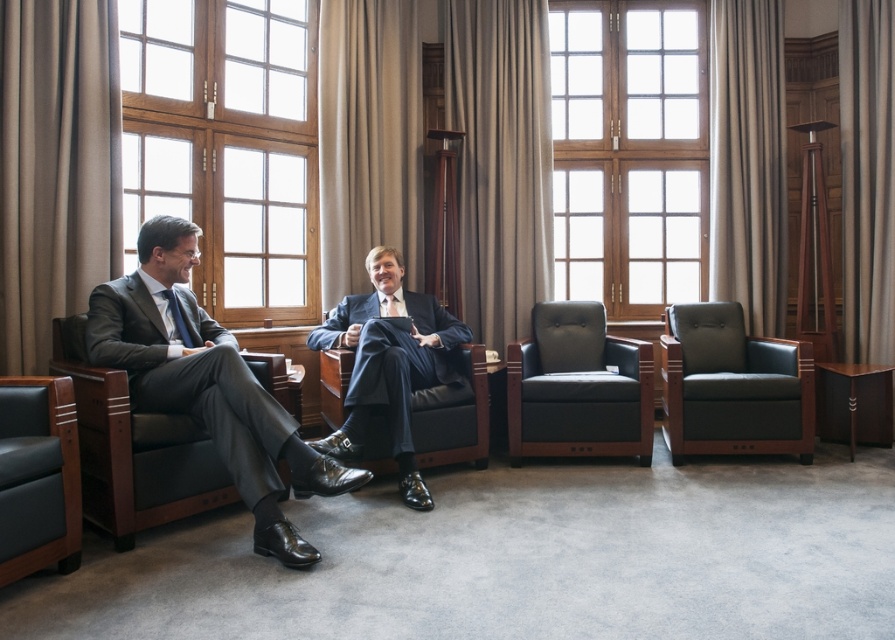
Question: Which object is farther from the camera taking this photo?

Choices:
 (A) beige fabric curtain at upper center
 (B) wooden frame at center
 (C) wooden frame at left
 (D) silky gray curtain at right

Answer: (C)

Question: Can you confirm if wooden frame at center is positioned to the right of matte black armchair at left?

Choices:
 (A) no
 (B) yes

Answer: (B)

Question: Can you confirm if silky gray curtain at right is thinner than leather armchair at left?

Choices:
 (A) no
 (B) yes

Answer: (B)

Question: Among these points, which one is farthest from the camera?

Choices:
 (A) (310, 321)
 (B) (96, 454)

Answer: (A)

Question: Considering the relative positions of wooden frame at left and leather armchair at left in the image provided, where is wooden frame at left located with respect to leather armchair at left?

Choices:
 (A) below
 (B) above

Answer: (B)

Question: Which of these objects is positioned closest to the beige fabric curtain at center?

Choices:
 (A) leather armchair at left
 (B) leather armchair at right

Answer: (B)